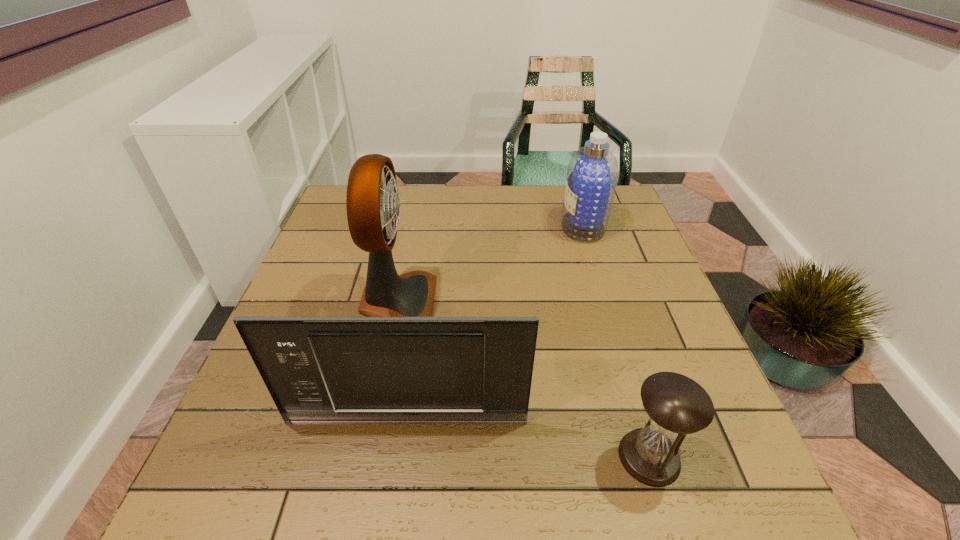
I want to click on object that is at the far edge, so click(592, 174).

Where is `object that is at the near edge`? The width and height of the screenshot is (960, 540). object that is at the near edge is located at coordinates (676, 405).

Identify the location of object that is at the left edge. (456, 370).

Find the location of a particular element. cleansing agent that is positioned at the right edge is located at coordinates (592, 174).

Locate an element on the screen. The height and width of the screenshot is (540, 960). hourglass that is at the right edge is located at coordinates (676, 405).

Locate an element on the screen. This screenshot has width=960, height=540. object that is at the far right corner is located at coordinates (592, 174).

The width and height of the screenshot is (960, 540). I want to click on object present at the near right corner, so click(x=676, y=405).

I want to click on vacant space at the far edge of the desktop, so click(x=401, y=202).

In the image, there is a desktop. Where is `vacant space at the near edge`? This screenshot has width=960, height=540. vacant space at the near edge is located at coordinates (526, 473).

Find the location of a particular element. vacant space at the left edge of the desktop is located at coordinates (309, 294).